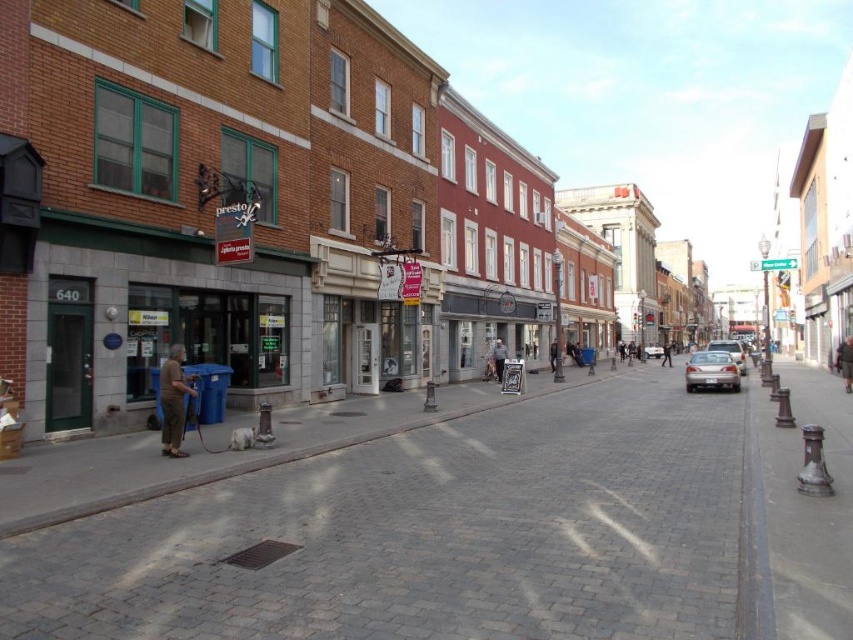
Does brown leather jacket at center come in front of silver metallic sedan at center?

Yes, it is.

Identify the location of brown leather jacket at center. Image resolution: width=853 pixels, height=640 pixels. (845, 362).

Does silver metallic sedan at center-right have a larger size compared to silver metallic sedan at right?

Incorrect, silver metallic sedan at center-right is not larger than silver metallic sedan at right.

Between silver metallic sedan at center-right and silver metallic sedan at right, which one is positioned higher?

silver metallic sedan at center-right

Is point (683, 372) behind point (746, 365)?

Yes, point (683, 372) is farther from viewer.

Find the location of a particular element. The image size is (853, 640). silver metallic sedan at center-right is located at coordinates (711, 371).

Who is positioned more to the right, brown cotton shirt at lower left or dark blue jeans at center?

dark blue jeans at center is more to the right.

What do you see at coordinates (173, 401) in the screenshot? The width and height of the screenshot is (853, 640). I see `brown cotton shirt at lower left` at bounding box center [173, 401].

Find the location of a particular element. brown cotton shirt at lower left is located at coordinates click(x=173, y=401).